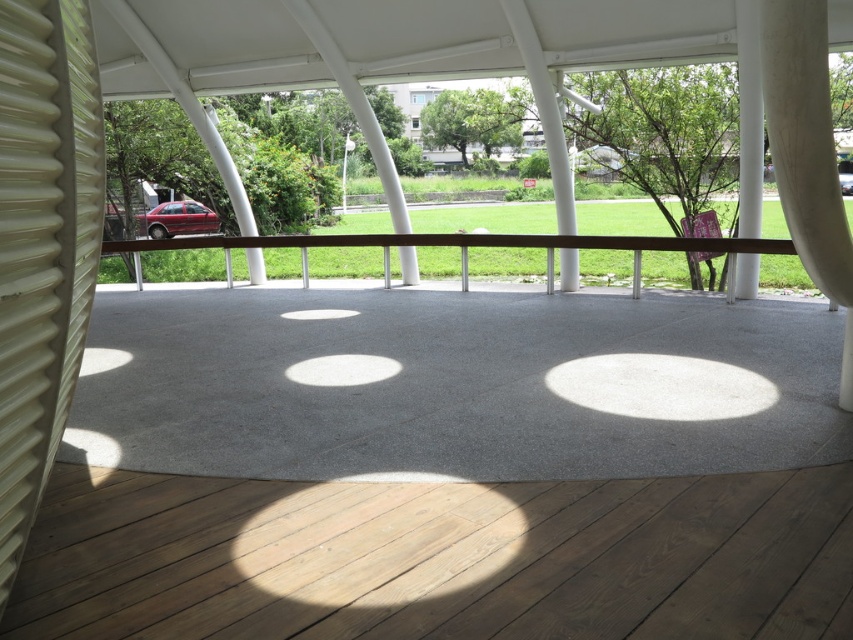
Question: Which point appears closest to the camera in this image?

Choices:
 (A) (741, 250)
 (B) (171, 209)
 (C) (793, 212)
 (D) (74, 300)

Answer: (D)

Question: Considering the relative positions of white corrugated plastic at left and white matte curtain at upper right in the image provided, where is white corrugated plastic at left located with respect to white matte curtain at upper right?

Choices:
 (A) right
 (B) left

Answer: (B)

Question: Which of these objects is positioned farthest from the brown polished wood rail at center?

Choices:
 (A) white matte curtain at upper right
 (B) white corrugated plastic at left

Answer: (B)

Question: Which object appears closest to the camera in this image?

Choices:
 (A) white corrugated plastic at left
 (B) white matte curtain at upper right
 (C) matte red car at left
 (D) brown polished wood rail at center

Answer: (A)

Question: Does white corrugated plastic at left have a smaller size compared to white matte curtain at upper right?

Choices:
 (A) yes
 (B) no

Answer: (A)

Question: Does brown polished wood rail at center come in front of matte red car at left?

Choices:
 (A) yes
 (B) no

Answer: (A)